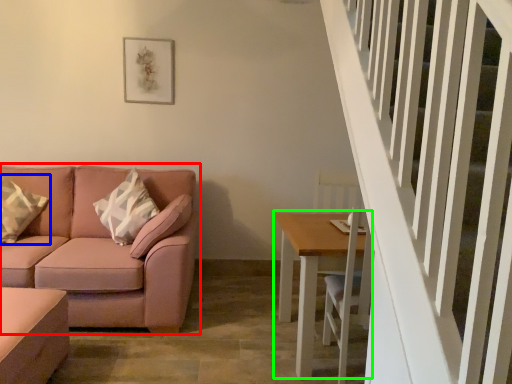
Question: Which is farther away from studio couch (highlighted by a red box)? pillow (highlighted by a blue box) or table (highlighted by a green box)?

Choices:
 (A) pillow
 (B) table

Answer: (B)